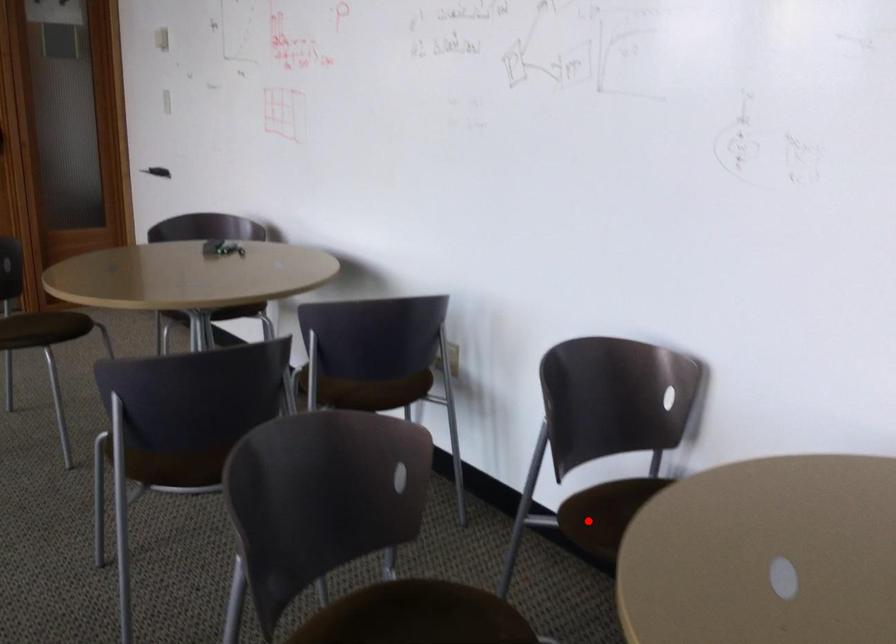
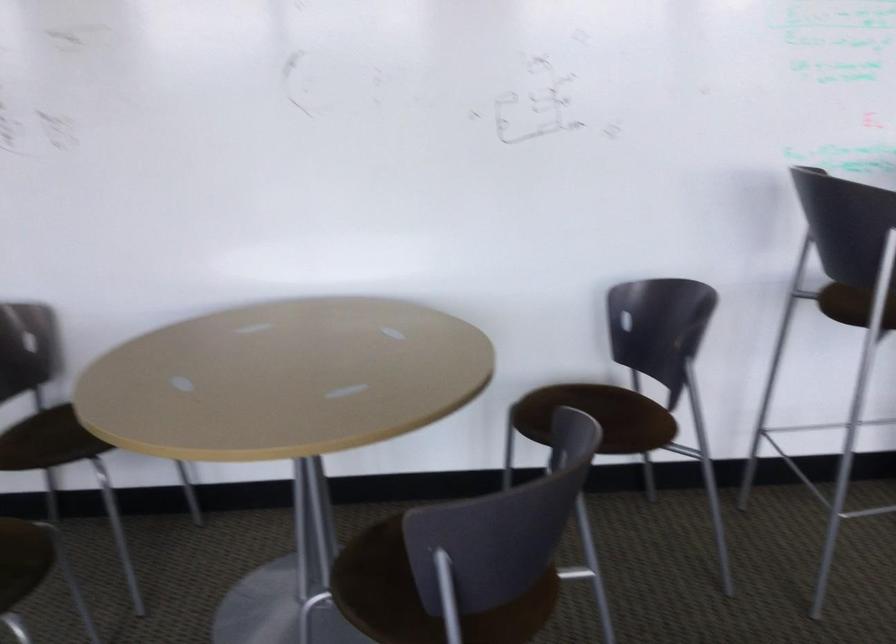
Question: I am providing you with two images of the same scene from different viewpoints. In image1, a red point is highlighted. Considering the same 3D point in image2, which of the following is correct?

Choices:
 (A) It is closer
 (B) It is farther

Answer: (B)